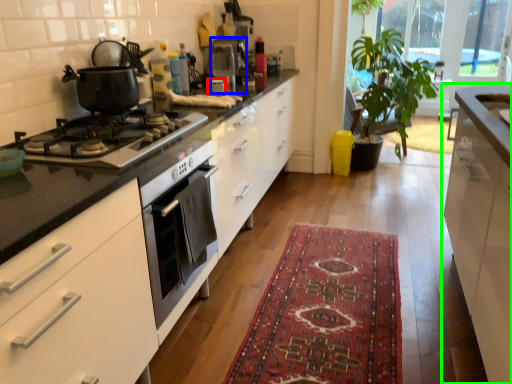
Question: Which object is the farthest from appliance (highlighted by a red box)? Choose among these: coffee machine (highlighted by a blue box) or cabinetry (highlighted by a green box).

Choices:
 (A) coffee machine
 (B) cabinetry

Answer: (B)